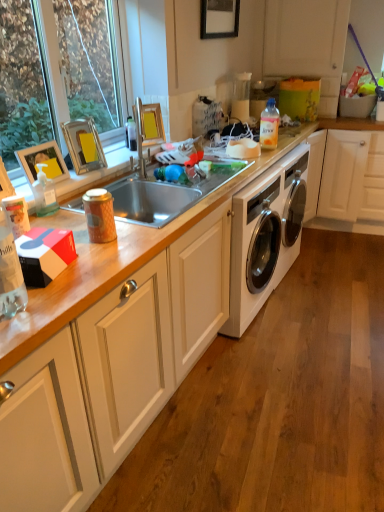
This screenshot has height=512, width=384. I want to click on free space in front of white glossy washing machine at center, so click(x=311, y=304).